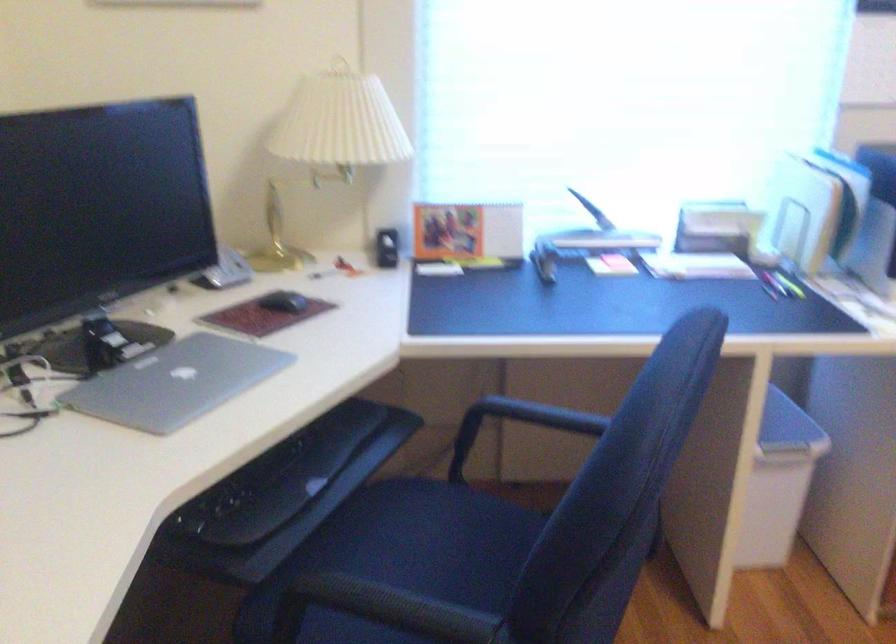
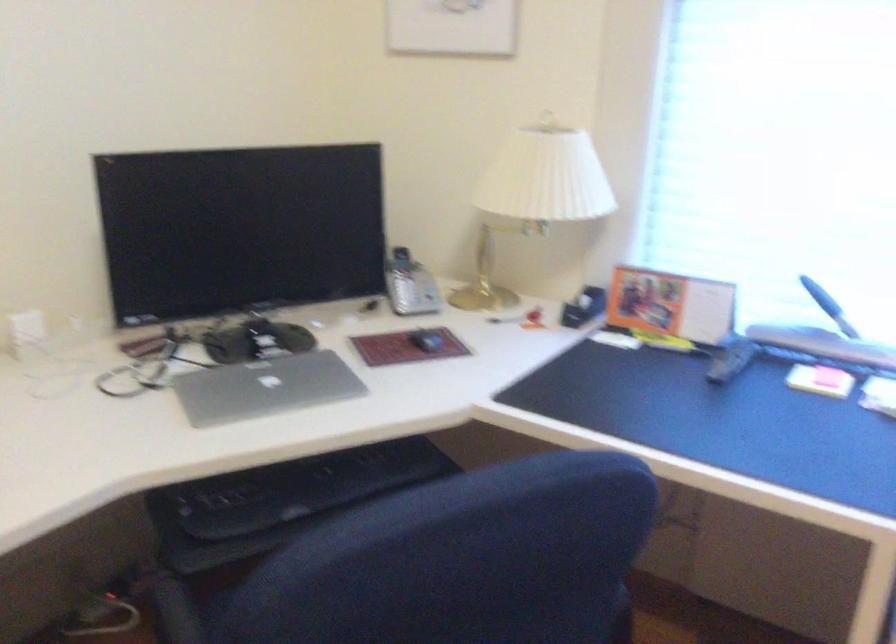
The point at (328,272) is marked in the first image. Where is the corresponding point in the second image?

(504, 319)